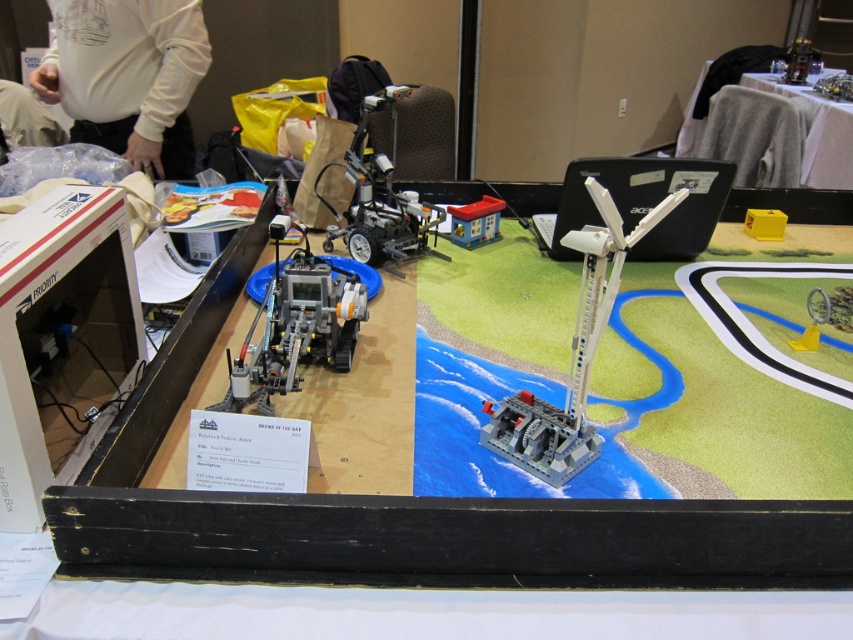
You are attending a robotics event and see the white matte shirt at upper left and the matte black wheelchair at center. Which object is positioned more to the left side of the display table?

The white matte shirt at upper left is positioned to the left of the matte black wheelchair at center, so it is more to the left side of the display table.

You are a participant at the event and need to place a small 10cm tall object on the surface. Which object from the display case, the white fabric table at upper right or the yellow plastic box at upper right, can accommodate the object without it toppling over?

The white fabric table at upper right is taller than the yellow plastic box at upper right, so the object can be placed on the white fabric table at upper right as it has a larger surface area to prevent toppling.